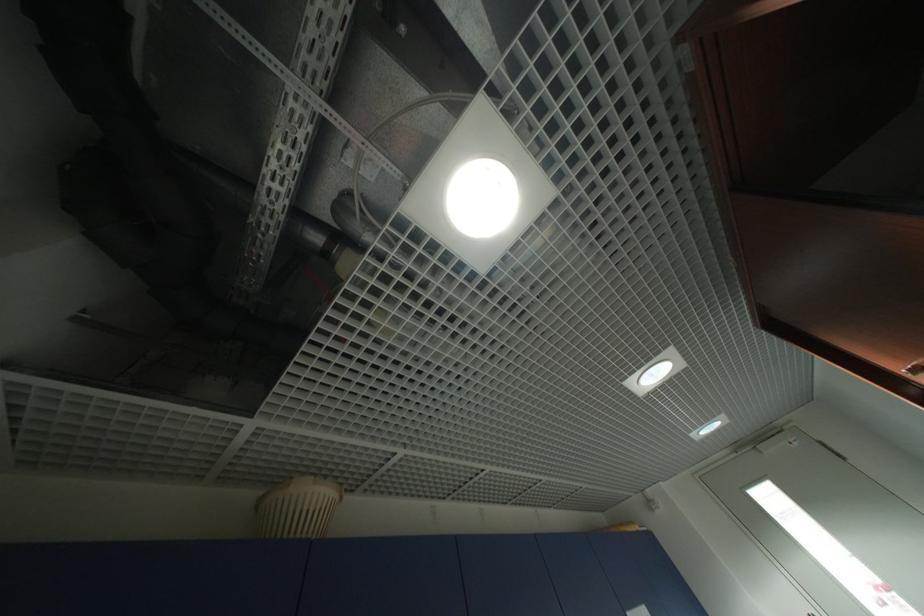
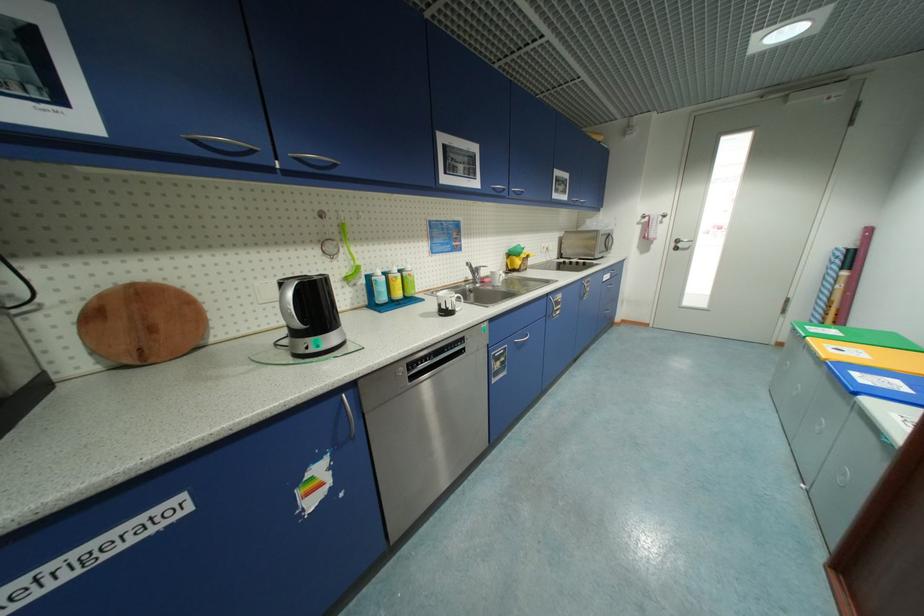
Based on the continuous images, in which direction is the camera rotating?

The rotation direction of the camera is right-down.